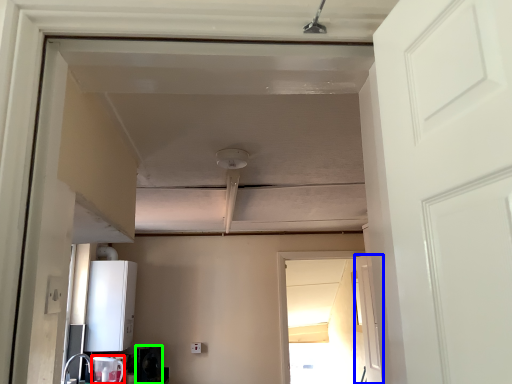
Question: Which object is positioned closest to appliance (highlighted by a red box)? Select from door (highlighted by a blue box) and appliance (highlighted by a green box).

Choices:
 (A) door
 (B) appliance

Answer: (B)